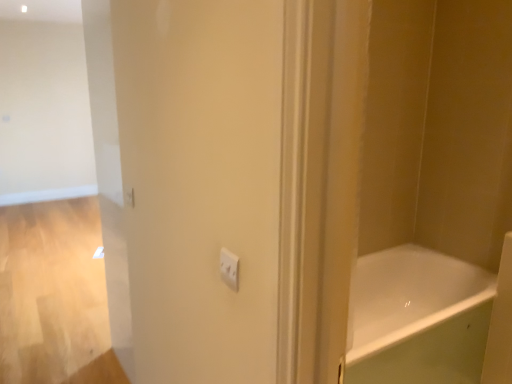
Question: Does white plastic light switch at center lie behind white glossy bathtub at center?

Choices:
 (A) no
 (B) yes

Answer: (A)

Question: From a real-world perspective, is white plastic light switch at center below white glossy bathtub at center?

Choices:
 (A) no
 (B) yes

Answer: (A)

Question: Considering the relative sizes of white plastic light switch at center and white glossy bathtub at center in the image provided, is white plastic light switch at center smaller than white glossy bathtub at center?

Choices:
 (A) no
 (B) yes

Answer: (B)

Question: Is white plastic light switch at center completely or partially outside of white glossy bathtub at center?

Choices:
 (A) no
 (B) yes

Answer: (B)

Question: Is white plastic light switch at center aimed at white glossy bathtub at center?

Choices:
 (A) no
 (B) yes

Answer: (A)

Question: Is there a large distance between white plastic light switch at center and white glossy bathtub at center?

Choices:
 (A) no
 (B) yes

Answer: (B)

Question: Is white glossy bathtub at center outside white plastic light switch at center?

Choices:
 (A) no
 (B) yes

Answer: (B)

Question: Would you say white glossy bathtub at center contains white plastic light switch at center?

Choices:
 (A) no
 (B) yes

Answer: (A)

Question: Does white glossy bathtub at center have a lesser width compared to white plastic light switch at center?

Choices:
 (A) yes
 (B) no

Answer: (B)

Question: From a real-world perspective, is white glossy bathtub at center under white plastic light switch at center?

Choices:
 (A) no
 (B) yes

Answer: (B)

Question: Does white glossy bathtub at center have a greater width compared to white plastic light switch at center?

Choices:
 (A) yes
 (B) no

Answer: (A)

Question: Can you confirm if white glossy bathtub at center is bigger than white plastic light switch at center?

Choices:
 (A) yes
 (B) no

Answer: (A)

Question: Considering the positions of white plastic light switch at center and white glossy bathtub at center in the image, is white plastic light switch at center wider or thinner than white glossy bathtub at center?

Choices:
 (A) wide
 (B) thin

Answer: (B)